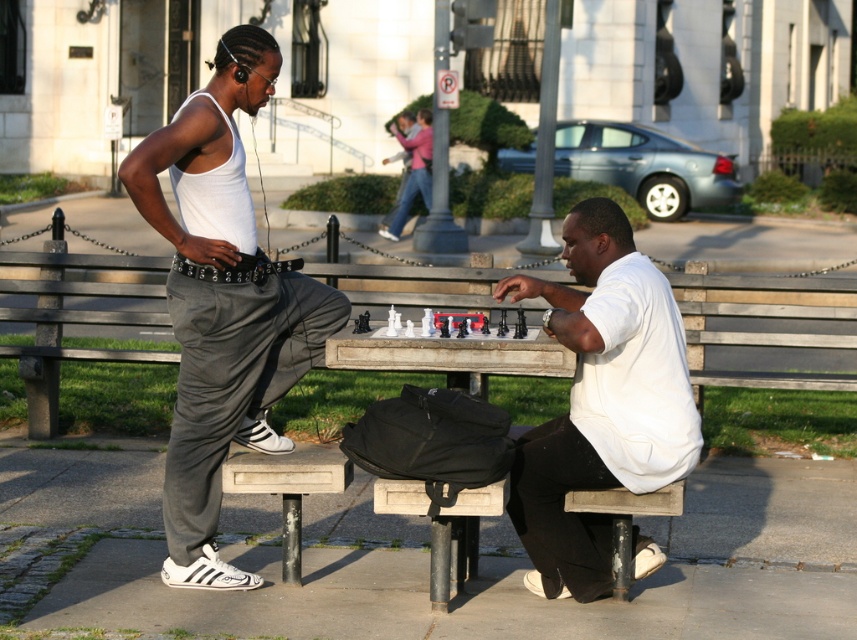
Based on the photo, you are a photographer trying to capture the scene of the chess game. You want to ensure both the white matte shirt at center and the pink fabric scarf at upper center are visible in your photo. Based on their positions, which object should you focus on first to include both in the frame?

The white matte shirt at center is below the pink fabric scarf at upper center, so focusing on the pink fabric scarf at upper center first would allow you to include both objects in the frame since it is positioned higher up.

You are a photographer trying to capture a clear shot of the pink fabric scarf at upper center without the white matte tank top at left blocking it. Based on their positions, is this possible?

The white matte tank top at left is in front of the pink fabric scarf at upper center, so it is blocking the view. To capture a clear shot of the pink fabric scarf at upper center, you would need to adjust your angle or move the white matte tank top at left out of the way.

You are a photographer planning to take a group photo of the two people in the chess scene. You want to ensure both the white matte tank top at left and the white matte shirt at center are clearly visible. Since lighting can sometimes cause issues with white clothing, which person might you ask to move slightly to avoid being backlit by the sun?

The white matte tank top at left has a larger width than the white matte shirt at center, so it might cast a bigger shadow. To avoid backlighting issues, you could ask the person wearing the white matte tank top at left to move slightly so their shadow doesn not block the sunlight from the white matte shirt at center.